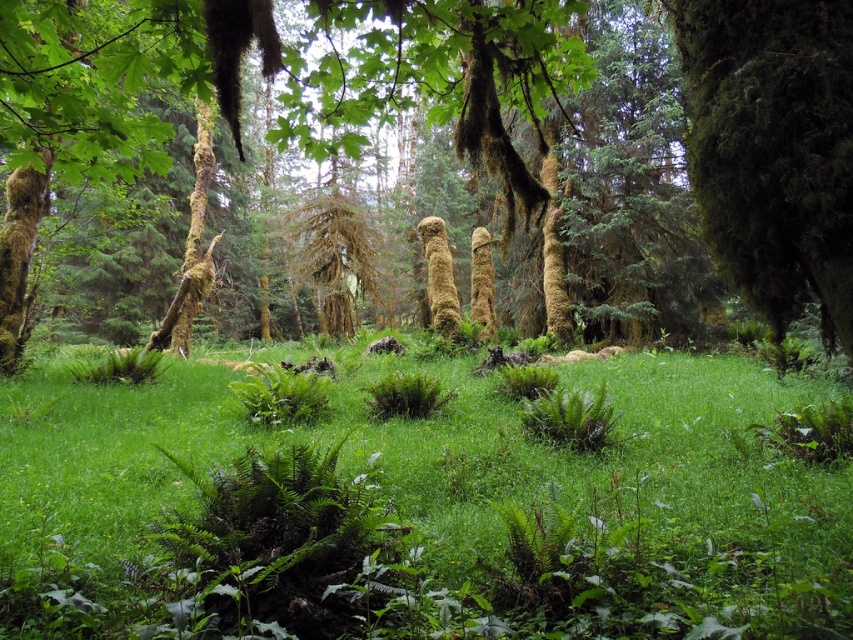
Describe the element at coordinates (425, 506) in the screenshot. This screenshot has width=853, height=640. I see `green grassy at center` at that location.

Is point (374, 604) positioned behind point (836, 308)?

Yes, point (374, 604) is behind point (836, 308).

This screenshot has width=853, height=640. I want to click on green grassy at center, so click(425, 506).

Which of these two, green mossy tree at right or green mossy tree trunk at left, stands taller?

green mossy tree trunk at left

The width and height of the screenshot is (853, 640). What do you see at coordinates (773, 148) in the screenshot?
I see `green mossy tree at right` at bounding box center [773, 148].

Is point (729, 195) less distant than point (13, 218)?

Yes, point (729, 195) is in front of point (13, 218).

Locate an element on the screen. Image resolution: width=853 pixels, height=640 pixels. green mossy tree at right is located at coordinates (773, 148).

Is green grassy at center below green mossy tree trunk at left?

Indeed, green grassy at center is positioned under green mossy tree trunk at left.

Image resolution: width=853 pixels, height=640 pixels. Describe the element at coordinates (425, 506) in the screenshot. I see `green grassy at center` at that location.

This screenshot has height=640, width=853. In order to click on green grassy at center in this screenshot , I will do `click(425, 506)`.